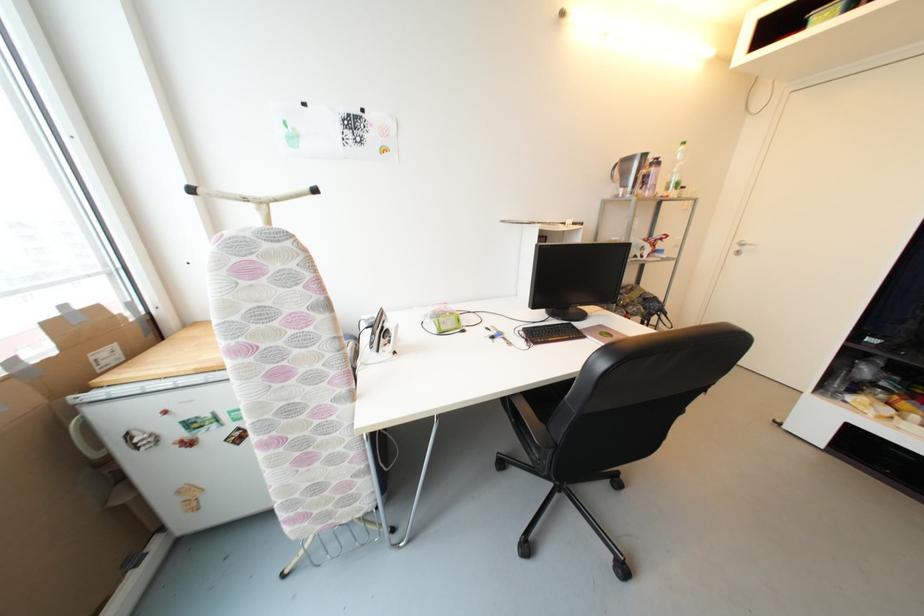
At what (x,y) coordinates should I click in order to perform the action: click on white fridge handle. Please return your answer as a coordinate pair (x, y). Looking at the image, I should click on (86, 442).